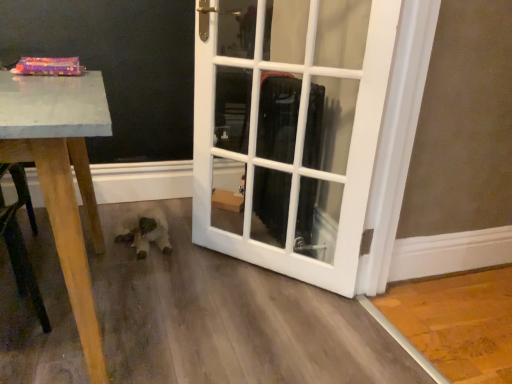
I want to click on free space behind white plush toy at lower center, so point(158,205).